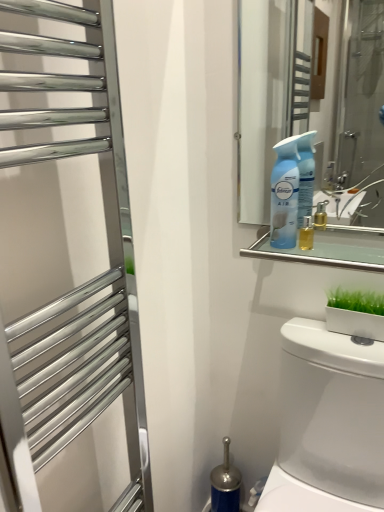
The image size is (384, 512). What are the coordinates of `free location to the right of blue plastic spray bottle at upper right` in the screenshot? It's located at (334, 246).